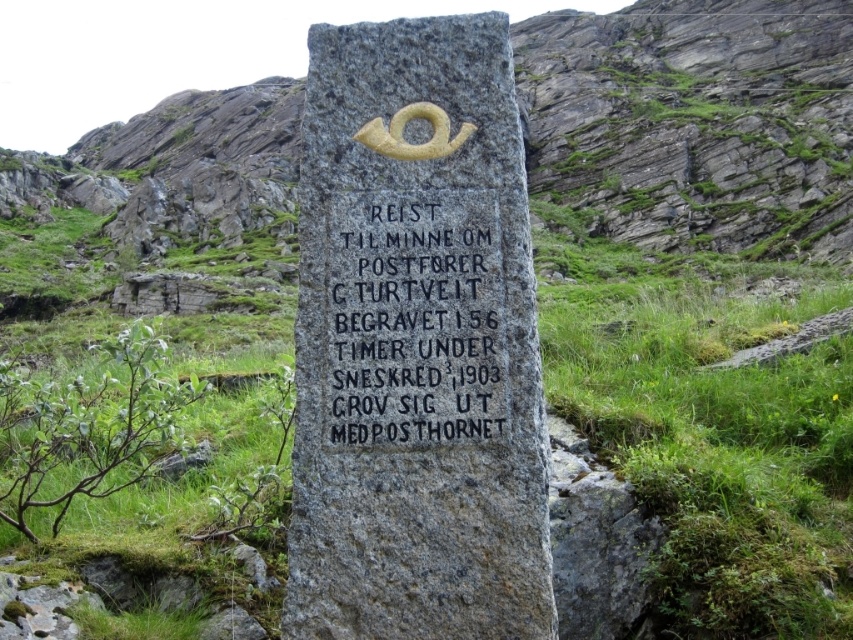
Question: Does gray stone monument at center lie behind black granite stone at center?

Choices:
 (A) yes
 (B) no

Answer: (B)

Question: Does gray stone monument at center lie in front of black granite stone at center?

Choices:
 (A) yes
 (B) no

Answer: (A)

Question: Which point is closer to the camera taking this photo?

Choices:
 (A) (421, 328)
 (B) (399, 509)

Answer: (B)

Question: Is gray stone monument at center above black granite stone at center?

Choices:
 (A) yes
 (B) no

Answer: (A)

Question: Among these points, which one is nearest to the camera?

Choices:
 (A) (474, 272)
 (B) (282, 612)

Answer: (A)